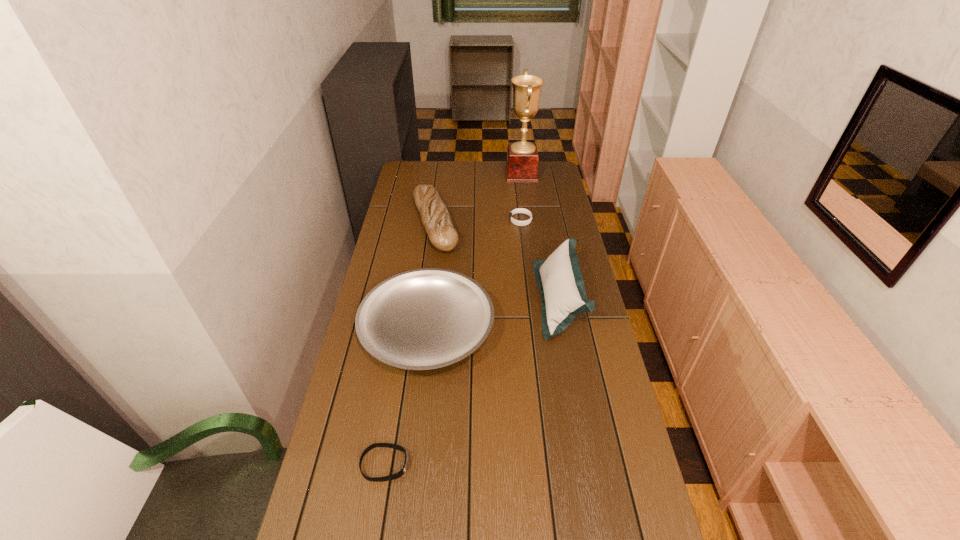
In the image, there is a desktop. Where is `free region at the right edge`? free region at the right edge is located at coordinates (587, 374).

Locate an element on the screen. This screenshot has height=540, width=960. free spot at the far right corner of the desktop is located at coordinates (531, 183).

I want to click on vacant area that lies between the trophy cup and the baguet, so click(x=478, y=199).

What are the coordinates of `blank region between the third shortest object and the tallest object` in the screenshot? It's located at (474, 253).

You are a GUI agent. You are given a task and a screenshot of the screen. Output one action in this format:
    pyautogui.click(x=<x>, y=<y>)
    Task: Click on the empty location between the cushion and the taller wristband
    
    Given the screenshot: What is the action you would take?
    pyautogui.click(x=540, y=260)

The width and height of the screenshot is (960, 540). Find the location of `unoccupied area between the baguet and the right wristband`. unoccupied area between the baguet and the right wristband is located at coordinates (478, 222).

Image resolution: width=960 pixels, height=540 pixels. I want to click on unoccupied area between the baguet and the farther wristband, so pyautogui.click(x=478, y=222).

Locate which object is the closest to the tallest object. Please provide its 2D coordinates. Your answer should be formatted as a tuple, i.e. [(x, y)], where the tuple contains the x and y coordinates of a point satisfying the conditions above.

[(435, 217)]

Identify which object is the fifth nearest to the baguet. Please provide its 2D coordinates. Your answer should be formatted as a tuple, i.e. [(x, y)], where the tuple contains the x and y coordinates of a point satisfying the conditions above.

[(397, 475)]